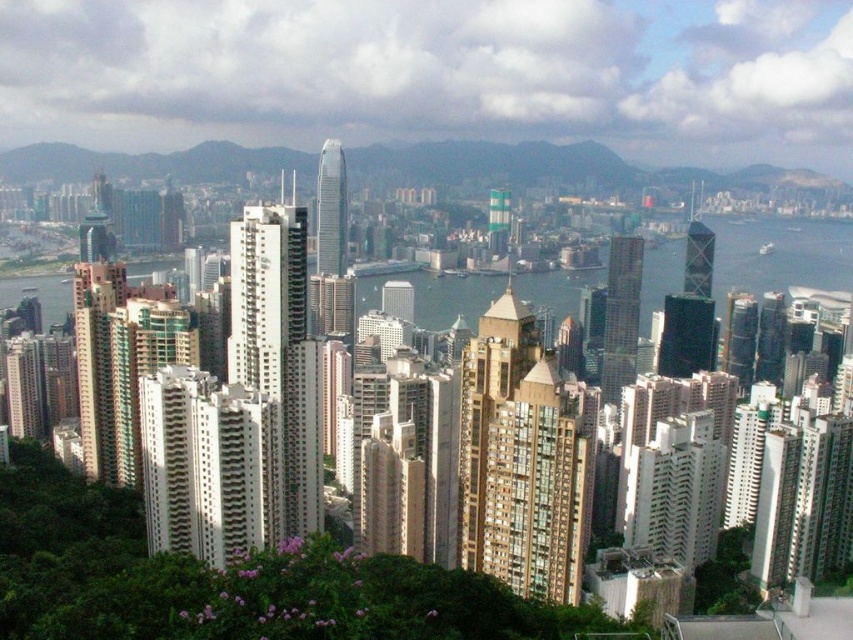
Question: Does transparent glass water at center come in front of glassy reflective skyscraper at center-right?

Choices:
 (A) no
 (B) yes

Answer: (B)

Question: Does white textured building at center appear over green glass tower at center?

Choices:
 (A) no
 (B) yes

Answer: (A)

Question: Which point appears closest to the camera in this image?

Choices:
 (A) (544, 294)
 (B) (374, 168)

Answer: (A)

Question: Is green grassy hillside at upper center bigger than glassy reflective skyscraper at center-right?

Choices:
 (A) no
 (B) yes

Answer: (B)

Question: Which object appears farthest from the camera in this image?

Choices:
 (A) glassy reflective skyscraper at center-right
 (B) shiny glass skyscraper at center

Answer: (A)

Question: Among these points, which one is nearest to the camera?

Choices:
 (A) (421, 144)
 (B) (608, 340)

Answer: (B)